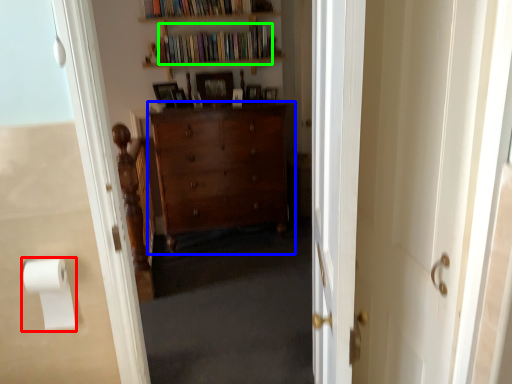
Question: Based on their relative distances, which object is nearer to toilet paper (highlighted by a red box)? Choose from cabinetry (highlighted by a blue box) and book (highlighted by a green box).

Choices:
 (A) cabinetry
 (B) book

Answer: (A)